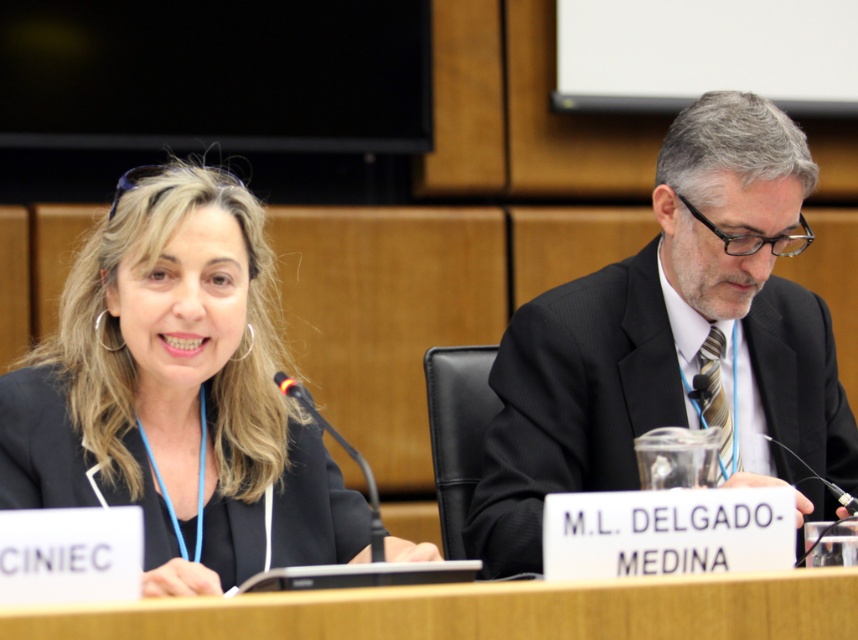
Who is positioned more to the right, wooden table at center or black matte blazer at left?

From the viewer's perspective, wooden table at center appears more on the right side.

Is the position of wooden table at center less distant than that of black matte blazer at left?

That is True.

Where is `wooden table at center`? The width and height of the screenshot is (858, 640). wooden table at center is located at coordinates (486, 611).

Which is behind, point (198, 550) or point (408, 636)?

The point (198, 550) is behind.

Which is below, matte black blazer at center or wooden table at center?

wooden table at center

Is point (77, 442) behind point (366, 636)?

Yes.

The height and width of the screenshot is (640, 858). I want to click on matte black blazer at center, so click(177, 394).

Which is below, black suit at right or black matte blazer at left?

black matte blazer at left

Is black suit at right to the right of black matte blazer at left from the viewer's perspective?

Yes, black suit at right is to the right of black matte blazer at left.

Is point (850, 483) farther from camera compared to point (260, 499)?

Yes, point (850, 483) is farther from viewer.

Locate an element on the screen. black suit at right is located at coordinates (666, 336).